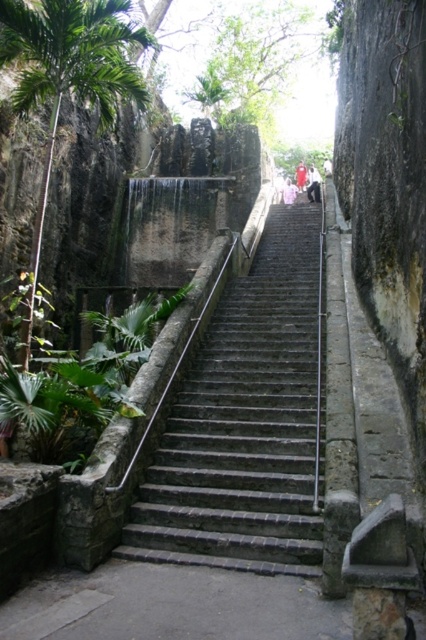
Between pink fabric at upper center and light pink fabric at upper center, which one has more height?

pink fabric at upper center

The height and width of the screenshot is (640, 426). In order to click on pink fabric at upper center in this screenshot , I will do `click(288, 192)`.

Where is `pink fabric at upper center`? The image size is (426, 640). pink fabric at upper center is located at coordinates (288, 192).

Can you confirm if gray stone stairs at center is positioned to the right of pink fabric at upper center?

Incorrect, gray stone stairs at center is not on the right side of pink fabric at upper center.

Does gray stone stairs at center have a lesser width compared to pink fabric at upper center?

Incorrect, gray stone stairs at center's width is not less than pink fabric at upper center's.

Where is `gray stone stairs at center`? Image resolution: width=426 pixels, height=640 pixels. gray stone stairs at center is located at coordinates [244, 422].

Image resolution: width=426 pixels, height=640 pixels. I want to click on gray stone stairs at center, so click(244, 422).

How distant is white cotton shirt at upper center from light pink fabric at upper center?

white cotton shirt at upper center is 2.43 meters away from light pink fabric at upper center.

Is white cotton shirt at upper center shorter than light pink fabric at upper center?

No.

Does point (310, 200) lie behind point (301, 170)?

No, it is not.

Where is `white cotton shirt at upper center`? The width and height of the screenshot is (426, 640). white cotton shirt at upper center is located at coordinates (313, 184).